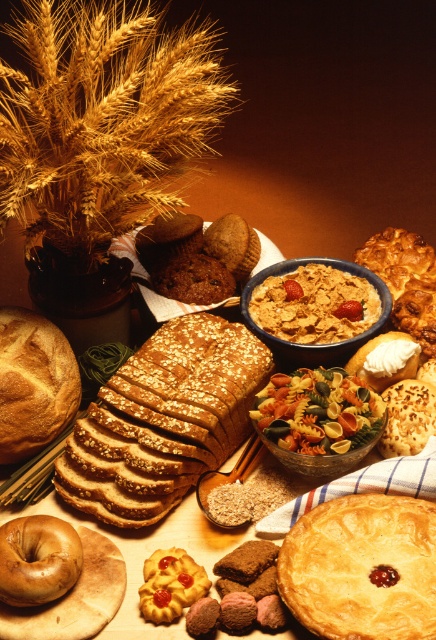
Which is below, golden brown crusty loaf of bread at left or brown crumbly biscuit at lower left?

brown crumbly biscuit at lower left

Measure the distance between point (2, 323) and camera.

A distance of 4.32 feet exists between point (2, 323) and camera.

What are the coordinates of `golden brown crusty loaf of bread at left` in the screenshot? It's located at (34, 381).

Is golden flaky pie at center further to camera compared to brown matte bagel at lower left?

No, golden flaky pie at center is closer to the viewer.

Is golden flaky pie at center above brown matte bagel at lower left?

Indeed, golden flaky pie at center is positioned over brown matte bagel at lower left.

The image size is (436, 640). Describe the element at coordinates (361, 568) in the screenshot. I see `golden flaky pie at center` at that location.

Identify the location of golden flaky pie at center. (361, 568).

Is golden crusty loaf of bread at center closer to camera compared to brown crumbly biscuit at lower left?

No, golden crusty loaf of bread at center is further to the viewer.

This screenshot has width=436, height=640. I want to click on golden crusty loaf of bread at center, so click(163, 420).

Image resolution: width=436 pixels, height=640 pixels. What are the coordinates of `golden crusty loaf of bread at center` in the screenshot? It's located at (163, 420).